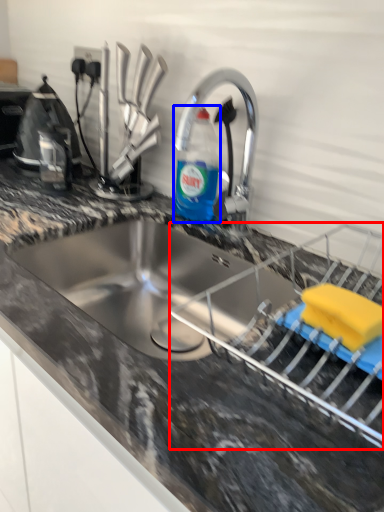
Question: Among these objects, which one is farthest to the camera, appliance (highlighted by a red box) or bottle (highlighted by a blue box)?

Choices:
 (A) appliance
 (B) bottle

Answer: (B)